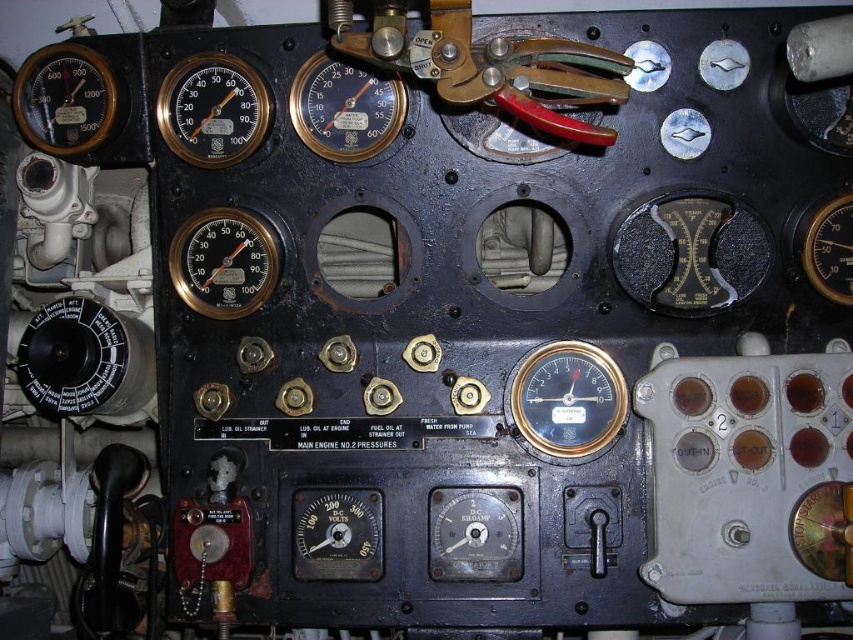
You are an engineer inspecting the control panel. You need to locate the matte black gauge at center right and the black metallic gauge at right. Which gauge is closer to the left edge of the control panel?

The matte black gauge at center right is positioned on the left side of the black metallic gauge at right, so it is closer to the left edge of the control panel.

You are an engineer inspecting the control panel. You notice two points labeled as point 1 and point 2. Point 1 is at coordinate (397,77) and point 2 is at coordinate (50,56). Which point is closer to your current position as you face the control panel?

Point 1 at coordinate (397,77) is closer to your current position because it is closer to the camera than point 2 at coordinate (50,56).

You are a technician needing to replace a faulty gauge. You have a tool that is 12 inches long. Can you safely place the tool between the matte black gauge at center right and the black metallic gauge at right without touching either?

The distance between the matte black gauge at center right and the black metallic gauge at right is 12.04 inches. Since the tool is 12 inches long, it can fit between them without touching either gauge.